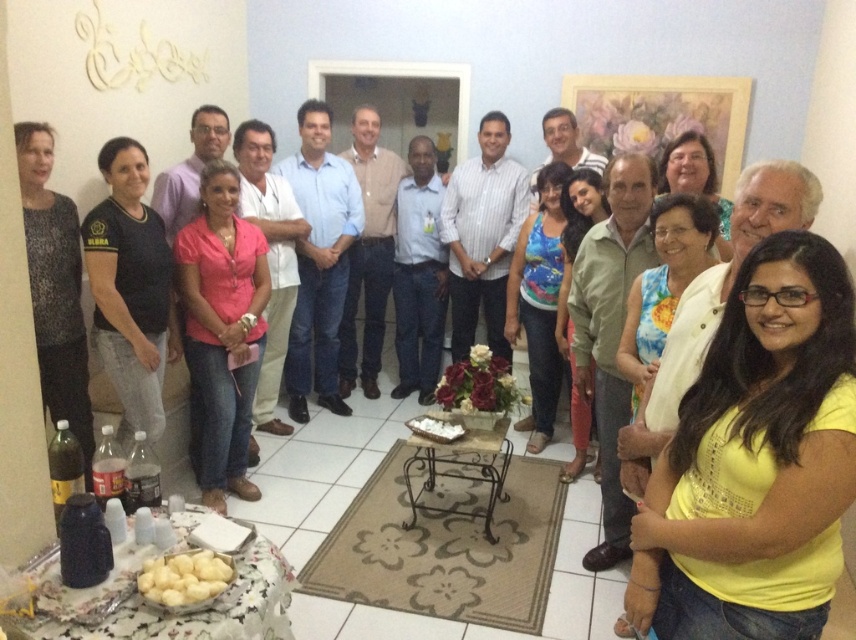
Can you confirm if black matte shirt at left is positioned to the left of matte black shirt at center?

Correct, you'll find black matte shirt at left to the left of matte black shirt at center.

Is black matte shirt at left thinner than matte black shirt at center?

Yes.

Measure the distance between point (111, 141) and camera.

Point (111, 141) and camera are 9.25 feet apart.

Locate an element on the screen. black matte shirt at left is located at coordinates (131, 288).

Does pink fabric shirt at center have a greater width compared to black matte shirt at left?

Yes.

Is point (262, 252) positioned after point (170, 352)?

Yes, it is behind point (170, 352).

Find the location of a particular element. This screenshot has height=640, width=856. pink fabric shirt at center is located at coordinates (223, 330).

Who is lower down, pink fabric shirt at center or multicolored floral dress at center?

pink fabric shirt at center

Does pink fabric shirt at center have a lesser height compared to multicolored floral dress at center?

No, pink fabric shirt at center is not shorter than multicolored floral dress at center.

Who is more forward, (207, 365) or (578, 444)?

Positioned in front is point (207, 365).

What are the coordinates of `pink fabric shirt at center` in the screenshot? It's located at (223, 330).